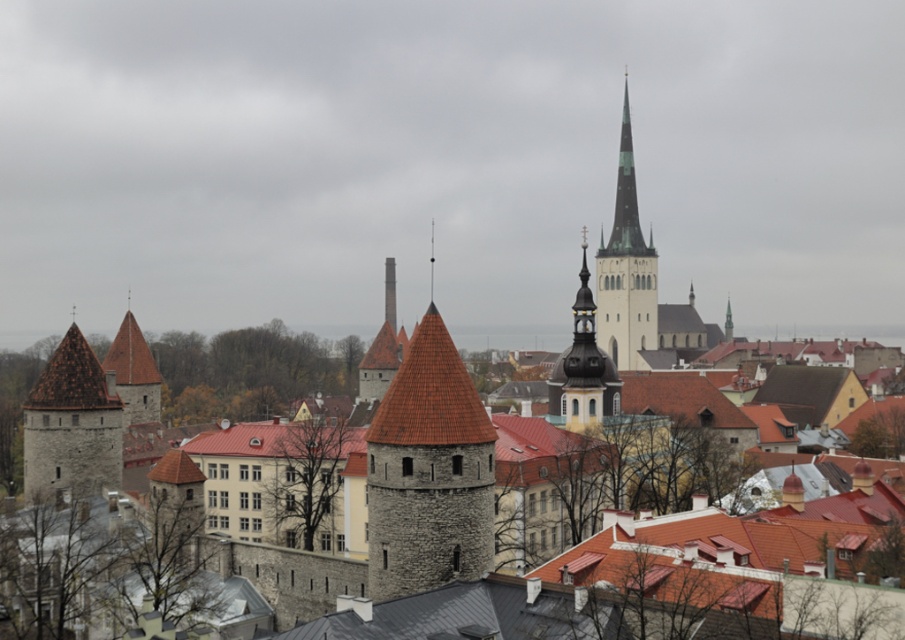
You are an architect visiting this historic city. You notice the stone brick tower at left and the gold textured spire at center. Which structure is closer to you as you stand in the foreground?

The stone brick tower at left is closer to you because it is positioned in front of the gold textured spire at center.